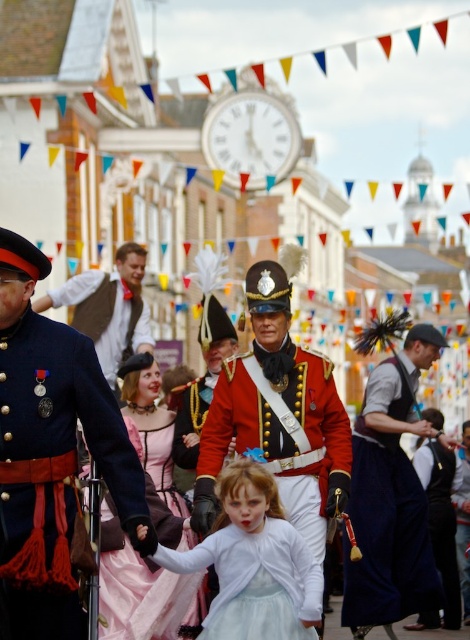
You are a festival attendee holding a 10 meter long banner that you need to hang between the shiny red uniform at center and the matte brown vest at center. Can you fit the banner between them?

The distance between the shiny red uniform at center and the matte brown vest at center is 13.13 meters. Since the banner is only 10 meters long, it will fit comfortably between them with 3.13 meters of extra space remaining.

You are a photographer positioned at the front of the street. You want to capture both the shiny red uniform at center and the white satin dress at center in the same frame. Which object should you focus on first to ensure both are in focus?

The shiny red uniform at center is taller than the white satin dress at center. To ensure both are in focus, you should focus on the shiny red uniform at center first since it is farther away from the camera, allowing the depth of field to cover the closer white satin dress at center.